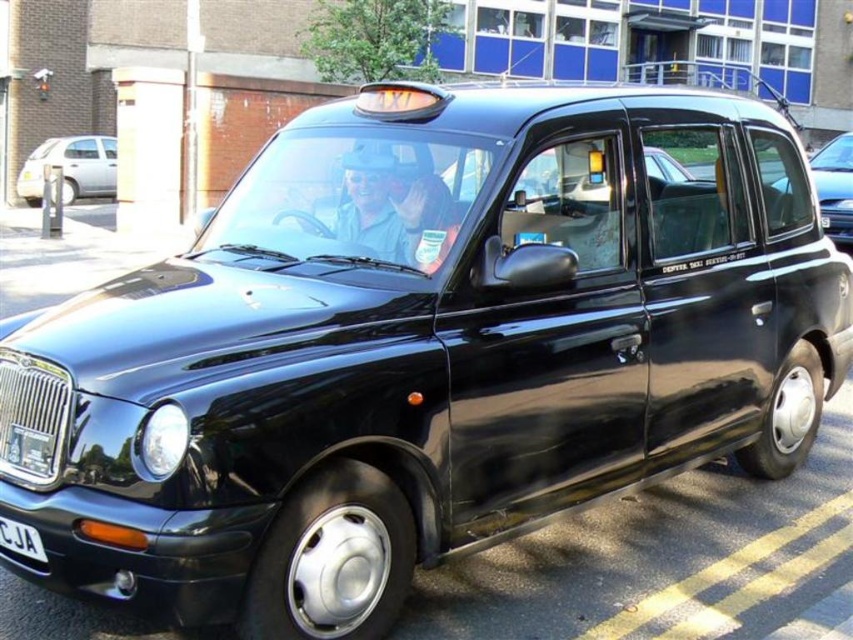
You are standing at the point marked by the coordinates (70, 168). You want to reach the silver metallic hatchback at left. Which direction should you move in?

The point marked by the coordinates (70, 168) indicates the silver metallic hatchback at left, so you are already at the silver metallic hatchback at left.

You are a pedestrian standing on the sidewalk facing the street. You see a silver metallic hatchback at left and a black matte taxi at right. Which vehicle is closer to your left side?

The silver metallic hatchback at left is to the left of the black matte taxi at right, so the silver metallic hatchback at left is closer to your left side.

You are a photographer standing on the sidewalk. You want to take a photo of the black matte taxi at right and the white plastic license plate at lower left. Which object should you focus on first if you want to capture both in sharp detail?

The black matte taxi at right is larger than the white plastic license plate at lower left, so you should focus on the black matte taxi at right first to ensure both are in sharp detail.